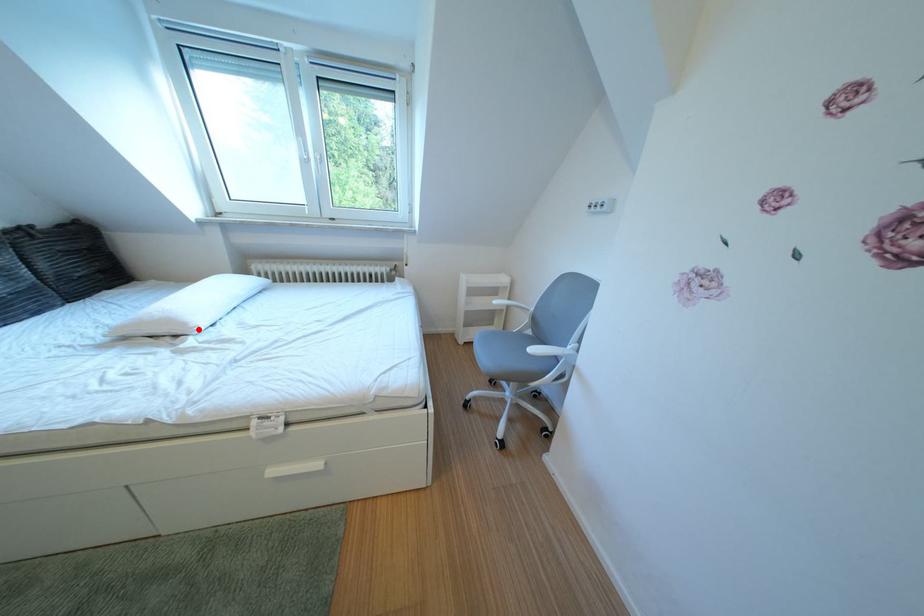
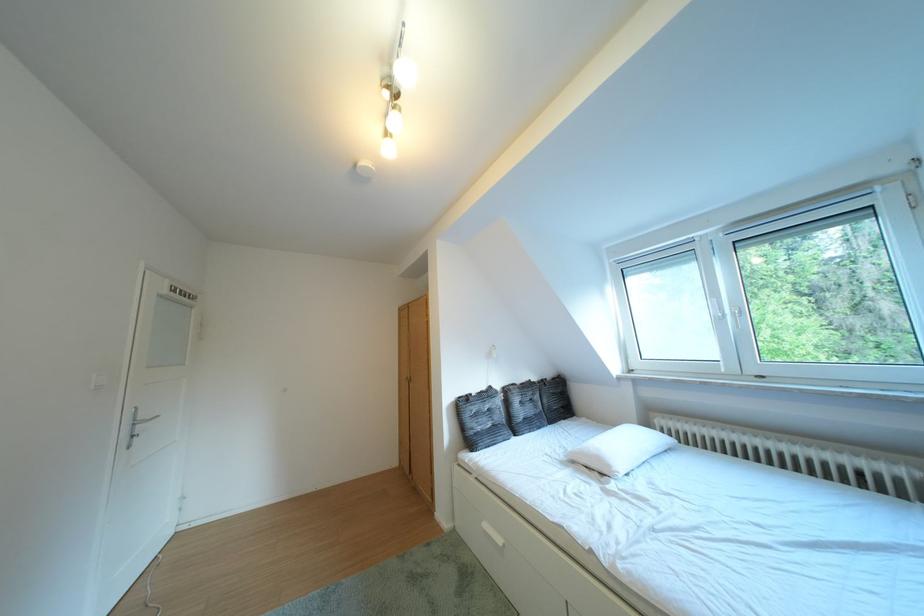
Where in the second image is the point corresponding to the highlighted location from the first image?

(623, 471)